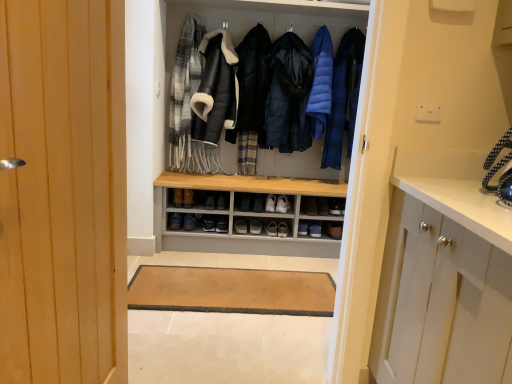
Question: In which direction should I rotate to look at dark blue puffer jacket at center, which is the first jacket in right-to-left order?

Choices:
 (A) right
 (B) left

Answer: (A)

Question: Is black leather shoe at center, the 3th footwear from the left, placed right next to black leather shoe at center, arranged as the second shoe when viewed from the right?

Choices:
 (A) yes
 (B) no

Answer: (B)

Question: Considering the relative sizes of black leather shoe at center, arranged as the fourth footwear when viewed from the right, and black leather shoe at center, the third shoe in the left-to-right sequence, in the image provided, is black leather shoe at center, arranged as the fourth footwear when viewed from the right, bigger than black leather shoe at center, the third shoe in the left-to-right sequence,?

Choices:
 (A) yes
 (B) no

Answer: (B)

Question: Does black leather shoe at center, arranged as the fourth footwear when viewed from the right, appear on the left side of black leather shoe at center, the third shoe in the left-to-right sequence?

Choices:
 (A) yes
 (B) no

Answer: (A)

Question: Does black leather shoe at center, arranged as the fourth footwear when viewed from the right, have a greater height compared to black leather shoe at center, arranged as the second shoe when viewed from the right?

Choices:
 (A) no
 (B) yes

Answer: (A)

Question: Considering the relative sizes of black leather shoe at center, the 3th footwear from the left, and black leather shoe at center, arranged as the second shoe when viewed from the right, in the image provided, is black leather shoe at center, the 3th footwear from the left, smaller than black leather shoe at center, arranged as the second shoe when viewed from the right,?

Choices:
 (A) yes
 (B) no

Answer: (A)

Question: Is black leather shoe at center, arranged as the fourth footwear when viewed from the right, shorter than black leather shoe at center, arranged as the second shoe when viewed from the right?

Choices:
 (A) no
 (B) yes

Answer: (B)

Question: Does wooden door at left touch plaid wool scarf at upper left?

Choices:
 (A) no
 (B) yes

Answer: (A)

Question: From the image's perspective, is wooden door at left located above plaid wool scarf at upper left?

Choices:
 (A) yes
 (B) no

Answer: (B)

Question: Can you confirm if wooden door at left is smaller than plaid wool scarf at upper left?

Choices:
 (A) no
 (B) yes

Answer: (A)

Question: From a real-world perspective, is wooden door at left under plaid wool scarf at upper left?

Choices:
 (A) no
 (B) yes

Answer: (B)

Question: Would you consider wooden door at left to be distant from plaid wool scarf at upper left?

Choices:
 (A) yes
 (B) no

Answer: (A)

Question: Can you confirm if wooden door at left is bigger than plaid wool scarf at upper left?

Choices:
 (A) yes
 (B) no

Answer: (A)

Question: From a real-world perspective, is black quilted jacket at center, the 1th jacket positioned from the left, physically above blue down jacket at center, acting as the second garment starting from the left?

Choices:
 (A) no
 (B) yes

Answer: (A)